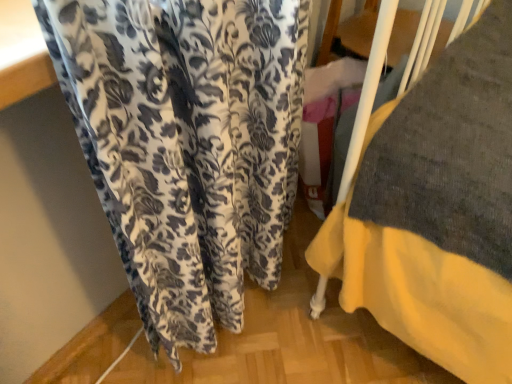
What is the approximate width of fluffy white curtain at center?

The width of fluffy white curtain at center is 11.15 inches.

What do you see at coordinates (187, 145) in the screenshot?
I see `fluffy white curtain at center` at bounding box center [187, 145].

Where is `fluffy white curtain at center`? fluffy white curtain at center is located at coordinates [187, 145].

Identify the location of fluffy white curtain at center. The width and height of the screenshot is (512, 384). (187, 145).